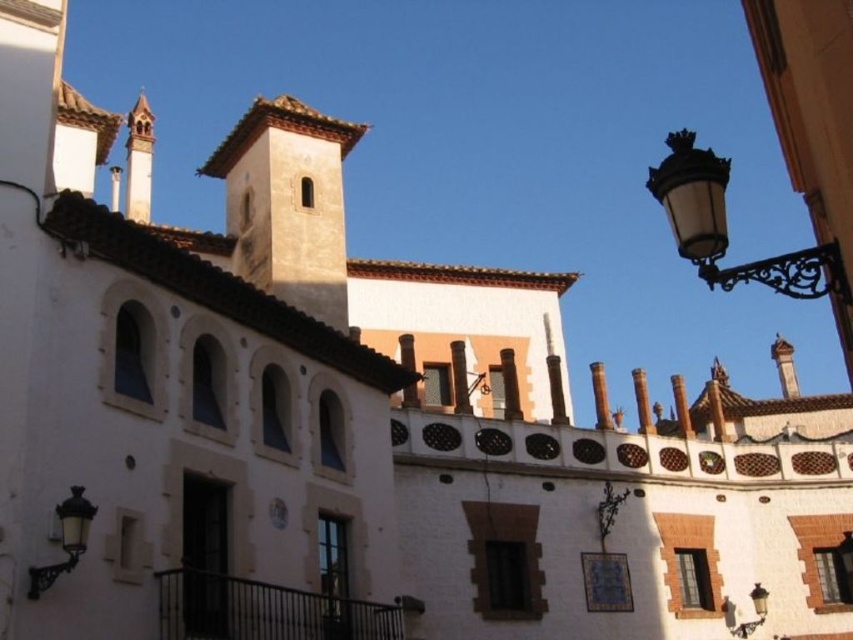
Is wooden spire at upper left smaller than black glass streetlamp at lower right?

A: No.

Does wooden spire at upper left appear over black glass streetlamp at lower right?

Yes, wooden spire at upper left is above black glass streetlamp at lower right.

Is point (135, 134) farther from viewer compared to point (751, 592)?

Yes, point (135, 134) is behind point (751, 592).

The width and height of the screenshot is (853, 640). I want to click on wooden spire at upper left, so click(x=138, y=161).

Can you confirm if brown textured tower at center is positioned below wooden spire at upper left?

Correct, brown textured tower at center is located below wooden spire at upper left.

Which is more to the left, brown textured tower at center or wooden spire at upper left?

wooden spire at upper left is more to the left.

Who is more distant from viewer, (294, 202) or (138, 211)?

The point (138, 211) is behind.

At what (x,y) coordinates should I click in order to perform the action: click on brown textured tower at center. Please return your answer as a coordinate pair (x, y). Image resolution: width=853 pixels, height=640 pixels. Looking at the image, I should click on (288, 204).

Does brown textured tower at center have a lesser width compared to metallic clock at center?

Incorrect, brown textured tower at center's width is not less than metallic clock at center's.

Between point (305, 220) and point (282, 516), which one is positioned in front?

Positioned in front is point (282, 516).

You are a GUI agent. You are given a task and a screenshot of the screen. Output one action in this format:
    pyautogui.click(x=<x>, y=<y>)
    Task: Click on the brown textured tower at center
    This screenshot has height=640, width=853.
    Given the screenshot: What is the action you would take?
    pyautogui.click(x=288, y=204)